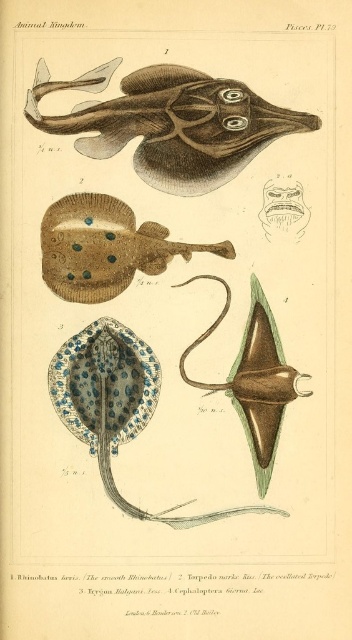
Question: Can you confirm if brown textured ray at upper center is positioned above brown textured stingray at upper center?

Choices:
 (A) yes
 (B) no

Answer: (A)

Question: Does brown textured ray at upper center appear on the left side of brown textured stingray at upper center?

Choices:
 (A) no
 (B) yes

Answer: (A)

Question: Which of the following is the closest to the observer?

Choices:
 (A) brown textured ray at upper center
 (B) brown textured stingray at upper center

Answer: (B)

Question: Among these objects, which one is farthest from the camera?

Choices:
 (A) brown textured stingray at upper center
 (B) brown textured ray at upper center

Answer: (B)

Question: Does brown textured ray at upper center appear under brown textured stingray at upper center?

Choices:
 (A) yes
 (B) no

Answer: (B)